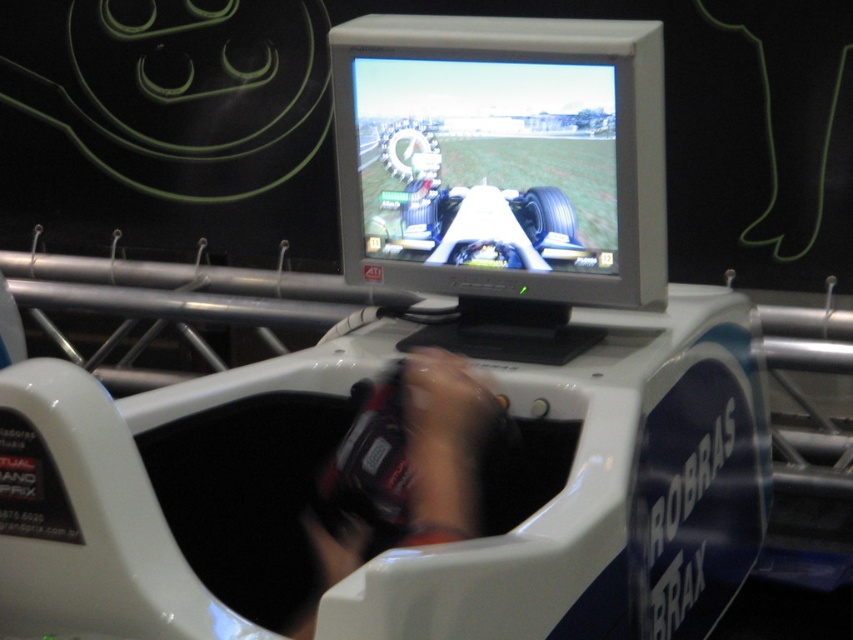
Question: Is matte silver monitor at center positioned in front of smooth black controller at center?

Choices:
 (A) no
 (B) yes

Answer: (A)

Question: Does matte silver monitor at center have a larger size compared to smooth black controller at center?

Choices:
 (A) no
 (B) yes

Answer: (B)

Question: Among these objects, which one is farthest from the camera?

Choices:
 (A) smooth black controller at center
 (B) matte silver monitor at center

Answer: (B)

Question: Can you confirm if matte silver monitor at center is wider than smooth black controller at center?

Choices:
 (A) yes
 (B) no

Answer: (A)